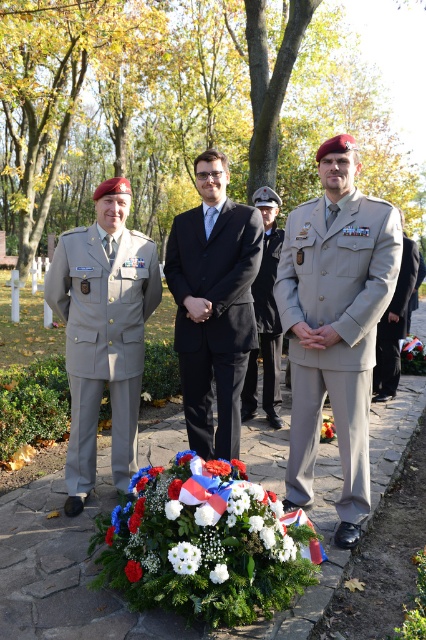
Question: Considering the real-world distances, which object is farthest from the satin black suit at center?

Choices:
 (A) red matte flower at center
 (B) matte khaki uniform at center
 (C) white matte flower at center

Answer: (A)

Question: Is matte khaki uniform at left above satin black suit at center?

Choices:
 (A) no
 (B) yes

Answer: (A)

Question: Can you confirm if satin black suit at center is positioned to the right of gray matte uniform at center?

Choices:
 (A) no
 (B) yes

Answer: (A)

Question: Among these objects, which one is nearest to the camera?

Choices:
 (A) matte khaki uniform at left
 (B) white fabric flower at center
 (C) white fluffy flower at center

Answer: (C)

Question: Where is matte khaki uniform at center located in relation to gray matte uniform at center in the image?

Choices:
 (A) above
 (B) below

Answer: (B)

Question: Which object is farther from the camera taking this photo?

Choices:
 (A) white matte flower at center
 (B) satin black suit at center
 (C) red matte flower at center
 (D) white floral bouquet at center

Answer: (B)